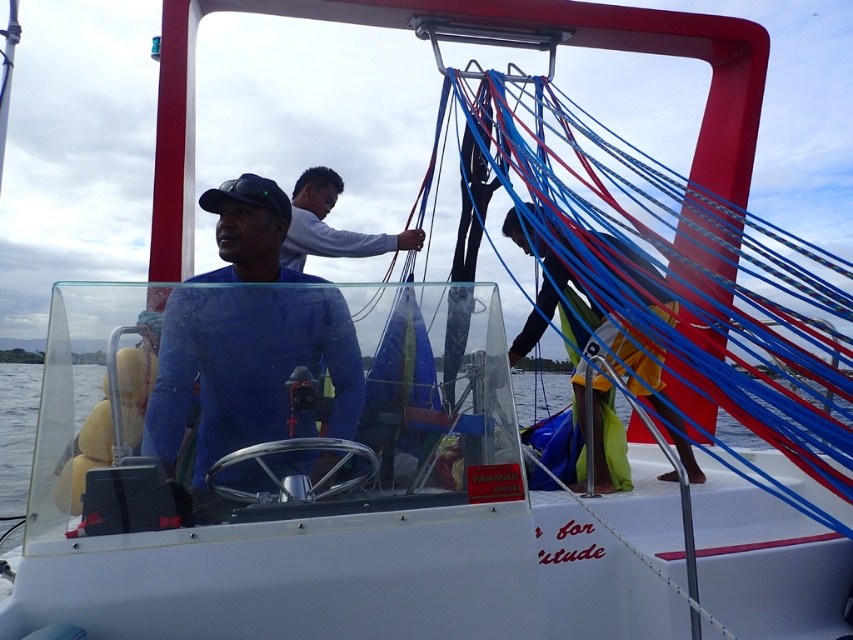
Question: Which point is closer to the camera?

Choices:
 (A) (320, 352)
 (B) (537, 301)

Answer: (A)

Question: Does blue matte shirt at center appear under white matte shirt at center?

Choices:
 (A) yes
 (B) no

Answer: (A)

Question: Which point is farther to the camera?

Choices:
 (A) blue matte shirt at center
 (B) transparent water at steering wheel left
 (C) yellow fabric at right

Answer: (C)

Question: Is transparent water at steering wheel left thinner than white matte shirt at center?

Choices:
 (A) yes
 (B) no

Answer: (B)

Question: Which point is closer to the camera?

Choices:
 (A) blue matte shirt at center
 (B) yellow fabric at right

Answer: (A)

Question: Is transparent water at steering wheel left smaller than white matte shirt at center?

Choices:
 (A) yes
 (B) no

Answer: (B)